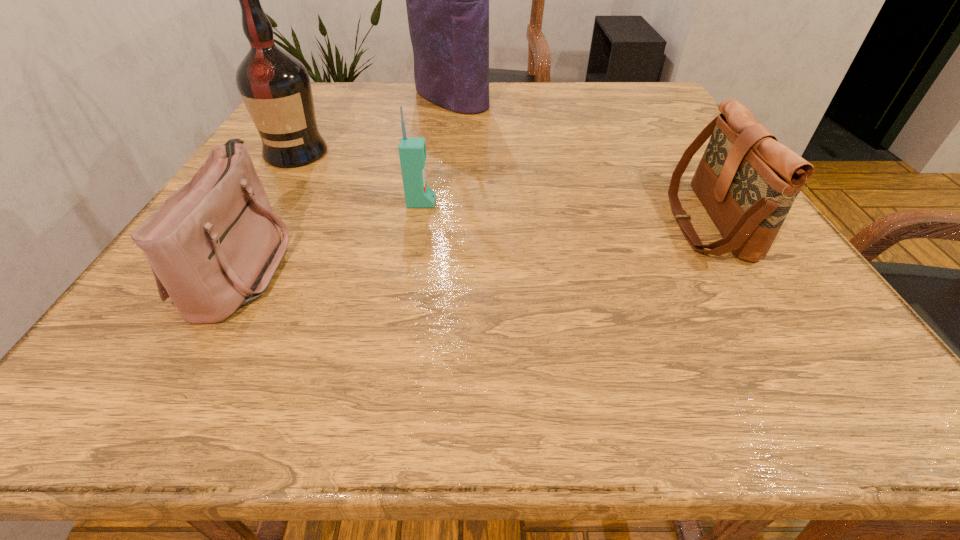
Locate an element on the screen. The image size is (960, 540). blank space located 0.340m on the front-facing side of the right shoulder bag is located at coordinates (481, 222).

This screenshot has width=960, height=540. Identify the location of vacant position located on the front-facing side of the right shoulder bag. (589, 222).

Image resolution: width=960 pixels, height=540 pixels. Find the location of `vacant space situated 0.060m on the front-facing side of the right shoulder bag`. vacant space situated 0.060m on the front-facing side of the right shoulder bag is located at coordinates (640, 222).

Where is `vacant space located on the front pocket of the left shoulder bag`? vacant space located on the front pocket of the left shoulder bag is located at coordinates (490, 266).

Identify the location of object at the far edge. (447, 0).

Identify the location of liquor positioned at the left edge. Image resolution: width=960 pixels, height=540 pixels. (275, 86).

Where is `shoulder bag situated at the left edge`? The image size is (960, 540). shoulder bag situated at the left edge is located at coordinates (214, 245).

Image resolution: width=960 pixels, height=540 pixels. Identify the location of object located at the right edge. (747, 181).

Find the location of `free spot at the far edge of the desktop`. free spot at the far edge of the desktop is located at coordinates (366, 97).

This screenshot has width=960, height=540. I want to click on vacant space at the near edge, so click(x=655, y=353).